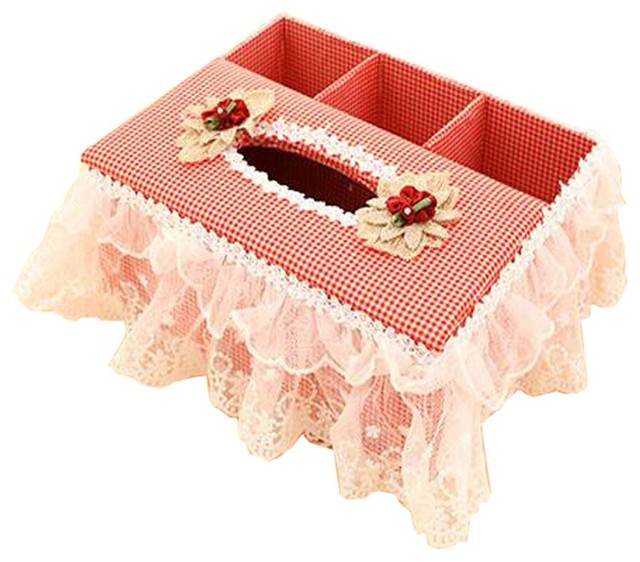
Find the location of a particular element. compartment is located at coordinates (390, 101).